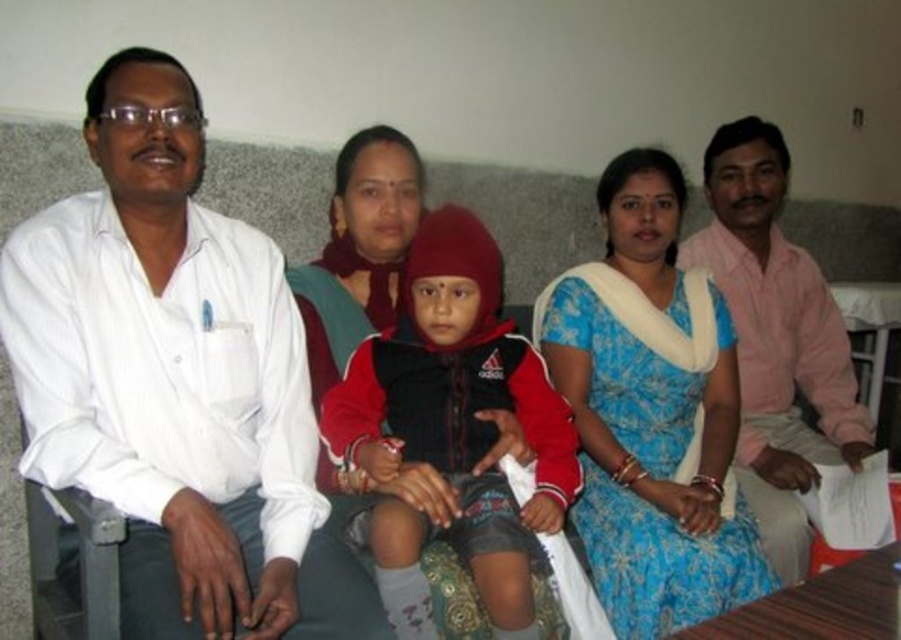
Question: Which point is farther to the camera?

Choices:
 (A) (470, 436)
 (B) (657, 403)
 (C) (772, 364)

Answer: (C)

Question: In this image, where is white shirt at left located relative to blue floral saree at center?

Choices:
 (A) right
 (B) left

Answer: (B)

Question: Which of the following is the farthest from the observer?

Choices:
 (A) (481, 403)
 (B) (766, 484)
 (C) (654, 308)

Answer: (B)

Question: Can you confirm if blue floral saree at center is bigger than red fleece jacket at center?

Choices:
 (A) yes
 (B) no

Answer: (A)

Question: Does white shirt at left appear under red fleece jacket at center?

Choices:
 (A) yes
 (B) no

Answer: (B)

Question: Which point is farther from the camera taking this photo?

Choices:
 (A) (797, 355)
 (B) (55, 304)
 (C) (684, 488)

Answer: (A)